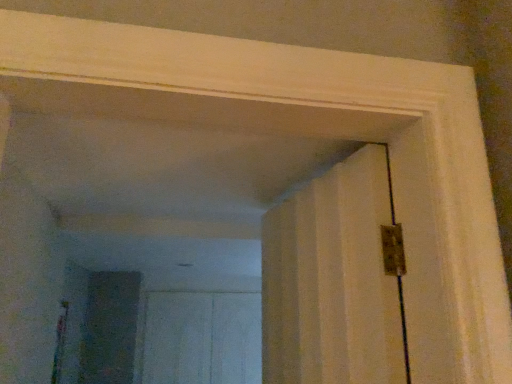
What do you see at coordinates (202, 338) in the screenshot?
I see `white matte door at center` at bounding box center [202, 338].

Measure the distance between point (176, 346) and camera.

Point (176, 346) and camera are 3.50 meters apart.

Based on the photo, what is the approximate width of white matte door at center?

27.45 inches.

The height and width of the screenshot is (384, 512). I want to click on white matte door at center, so click(202, 338).

The width and height of the screenshot is (512, 384). What are the coordinates of `white matte door at center` in the screenshot? It's located at (202, 338).